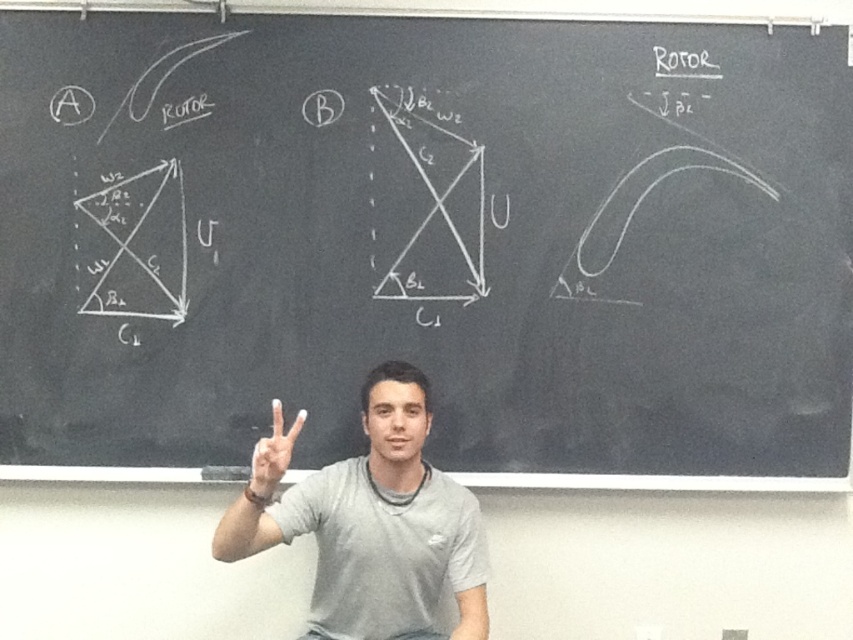
Does gray cotton shirt at center have a lesser height compared to white matte hand at center?

No, gray cotton shirt at center is not shorter than white matte hand at center.

Can you confirm if gray cotton shirt at center is bigger than white matte hand at center?

Yes, gray cotton shirt at center is bigger than white matte hand at center.

You are a GUI agent. You are given a task and a screenshot of the screen. Output one action in this format:
    pyautogui.click(x=<x>, y=<y>)
    Task: Click on the gray cotton shirt at center
    This screenshot has height=640, width=853.
    Given the screenshot: What is the action you would take?
    pyautogui.click(x=370, y=520)